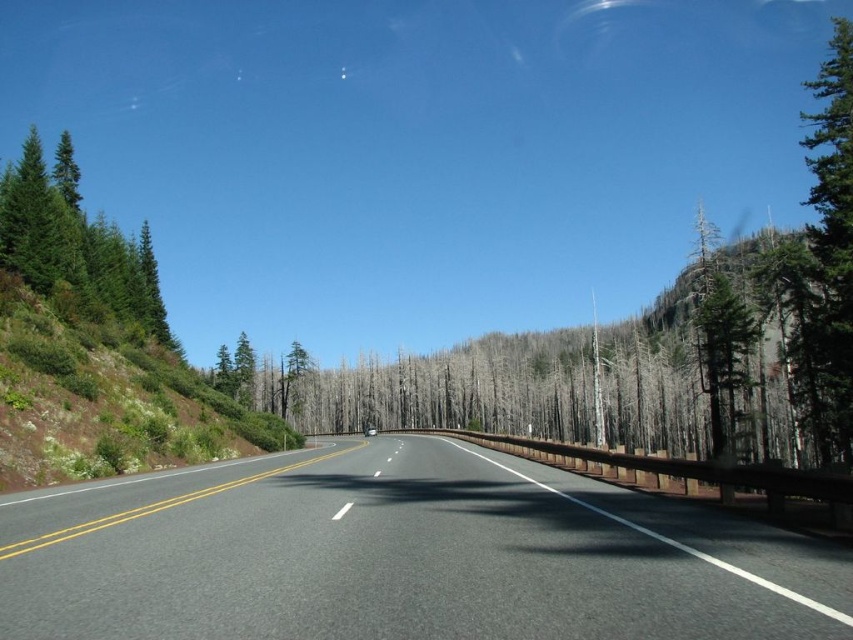
Question: Is green matte evergreen trees at left closer to the viewer compared to green rough bark tree at right?

Choices:
 (A) no
 (B) yes

Answer: (A)

Question: Which point appears closest to the camera in this image?

Choices:
 (A) (840, 344)
 (B) (489, 577)
 (C) (36, 200)
 (D) (10, 464)

Answer: (B)

Question: Does green shrubbery at left have a larger size compared to green rough bark tree at right?

Choices:
 (A) yes
 (B) no

Answer: (B)

Question: Can you confirm if green shrubbery at left is positioned above green rough bark tree at right?

Choices:
 (A) no
 (B) yes

Answer: (A)

Question: Based on their relative distances, which object is nearer to the green matte tree at right?

Choices:
 (A) green rough bark tree at right
 (B) black asphalt highway at center
 (C) green shrubbery at left

Answer: (A)

Question: Which object is positioned farthest from the green matte tree at right?

Choices:
 (A) green rough bark tree at right
 (B) green shrubbery at left

Answer: (B)